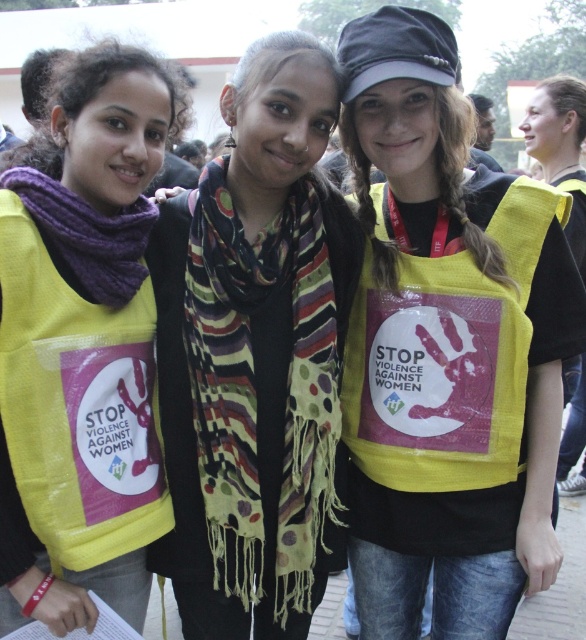
Does yellow fabric vest at left have a larger size compared to multicolored woven scarf at center?

Indeed, yellow fabric vest at left has a larger size compared to multicolored woven scarf at center.

Which is above, yellow fabric vest at left or multicolored woven scarf at center?

Positioned higher is yellow fabric vest at left.

Which is in front, point (91, 198) or point (251, 291)?

Point (91, 198) is more forward.

Find the location of a particular element. This screenshot has width=586, height=640. yellow fabric vest at left is located at coordinates (93, 180).

Between yellow fabric vest at center and matte yellow vest at right, which one is positioned higher?

matte yellow vest at right

In the scene shown: Is yellow fabric vest at center bigger than matte yellow vest at right?

No, yellow fabric vest at center is not bigger than matte yellow vest at right.

Between point (540, 326) and point (577, 145), which one is positioned in front?

Point (540, 326) is more forward.

At what (x,y) coordinates should I click in order to perform the action: click on yellow fabric vest at center. Please return your answer as a coordinate pair (x, y). This screenshot has width=586, height=640. Looking at the image, I should click on (445, 349).

Is multicolored woven scarf at center behind purple knitted scarf at left?

Yes, it is behind purple knitted scarf at left.

Who is taller, multicolored woven scarf at center or purple knitted scarf at left?

multicolored woven scarf at center

Does point (253, 456) come closer to viewer compared to point (47, 182)?

No, (253, 456) is behind (47, 182).

Identify the location of multicolored woven scarf at center. (255, 388).